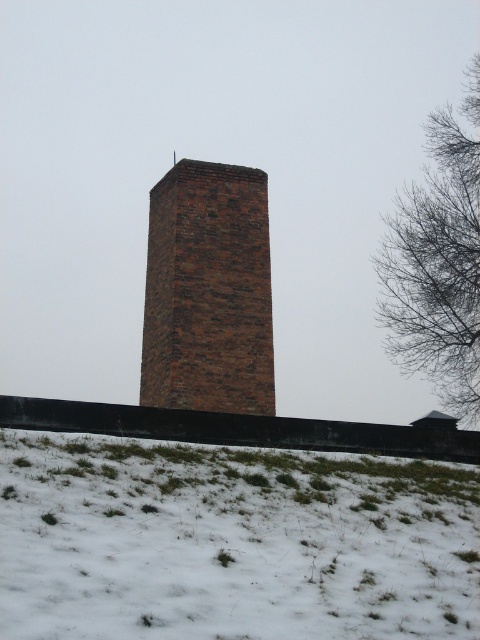
Question: Does white fluffy snow at lower center lie behind bare branches at upper right?

Choices:
 (A) no
 (B) yes

Answer: (A)

Question: Which object is farther from the camera taking this photo?

Choices:
 (A) white fluffy snow at lower center
 (B) brick chimney at center

Answer: (B)

Question: Which object appears farthest from the camera in this image?

Choices:
 (A) white fluffy snow at lower center
 (B) brick chimney at center
 (C) bare branches at upper right

Answer: (C)

Question: Is white fluffy snow at lower center above brick chimney at center?

Choices:
 (A) no
 (B) yes

Answer: (A)

Question: Which of the following is the farthest from the observer?

Choices:
 (A) tap(256, 412)
 (B) tap(192, 536)
 (C) tap(469, 316)

Answer: (C)

Question: Can you confirm if white fluffy snow at lower center is positioned to the left of bare branches at upper right?

Choices:
 (A) yes
 (B) no

Answer: (A)